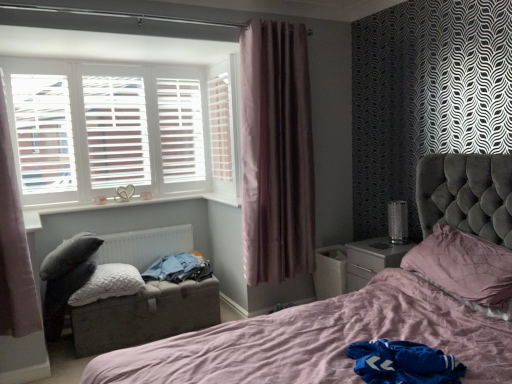
I want to click on vacant area on top of white wooden shutters at upper left (from a real-world perspective), so click(x=106, y=60).